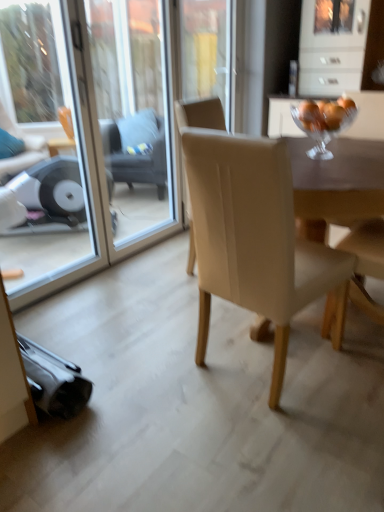
This screenshot has width=384, height=512. What do you see at coordinates (46, 151) in the screenshot?
I see `transparent glass screen door at left, which is counted as the 1th screen door, starting from the left` at bounding box center [46, 151].

Find the location of a particular element. dark gray fabric swivel chair at center is located at coordinates (138, 151).

Locate an element on the screen. This screenshot has height=512, width=384. beige fabric chair at center is located at coordinates (255, 238).

Image resolution: width=384 pixels, height=512 pixels. I want to click on clear glass bowl at upper right, so click(x=324, y=122).

Between clear glass bowl at upper right and dark gray fabric swivel chair at center, which one appears on the right side from the viewer's perspective?

clear glass bowl at upper right is more to the right.

Are clear glass bowl at upper right and dark gray fabric swivel chair at center far apart?

clear glass bowl at upper right is far away from dark gray fabric swivel chair at center.

Which object is thinner, transparent glass screen door at upper center, which appears as the 2th screen door when viewed from the left, or beige fabric chair at center?

Thinner between the two is transparent glass screen door at upper center, which appears as the 2th screen door when viewed from the left.

Considering the relative positions of transparent glass screen door at upper center, the 1th screen door when ordered from right to left, and beige fabric chair at center in the image provided, is transparent glass screen door at upper center, the 1th screen door when ordered from right to left, to the right of beige fabric chair at center from the viewer's perspective?

No.

From a real-world perspective, who is located lower, transparent glass screen door at upper center, which appears as the 2th screen door when viewed from the left, or beige fabric chair at center?

In real-world perspective, beige fabric chair at center is lower.

From the picture: Is clear glass bowl at upper right thinner than transparent glass screen door at left, marked as the second screen door in a right-to-left arrangement?

No.

From the image's perspective, who appears lower, clear glass bowl at upper right or transparent glass screen door at left, marked as the second screen door in a right-to-left arrangement?

transparent glass screen door at left, marked as the second screen door in a right-to-left arrangement, from the image's perspective.

Is clear glass bowl at upper right with transparent glass screen door at left, which is counted as the 1th screen door, starting from the left?

No, clear glass bowl at upper right is not in contact with transparent glass screen door at left, which is counted as the 1th screen door, starting from the left.

Is clear glass bowl at upper right oriented towards transparent glass screen door at left, marked as the second screen door in a right-to-left arrangement?

No, clear glass bowl at upper right is not turned towards transparent glass screen door at left, marked as the second screen door in a right-to-left arrangement.

Based on the photo, from the image's perspective, which object appears higher, clear glass bowl at upper right or transparent glass screen door at upper center, the 1th screen door when ordered from right to left?

transparent glass screen door at upper center, the 1th screen door when ordered from right to left.

Measure the distance from clear glass bowl at upper right to transparent glass screen door at upper center, the 1th screen door when ordered from right to left.

They are 5.69 feet apart.

In terms of height, does clear glass bowl at upper right look taller or shorter compared to transparent glass screen door at upper center, the 1th screen door when ordered from right to left?

In the image, clear glass bowl at upper right appears to be shorter than transparent glass screen door at upper center, the 1th screen door when ordered from right to left.

Based on the photo, does clear glass bowl at upper right have a greater width compared to transparent glass screen door at upper center, the 1th screen door when ordered from right to left?

Indeed, clear glass bowl at upper right has a greater width compared to transparent glass screen door at upper center, the 1th screen door when ordered from right to left.

Considering the sizes of clear glass bowl at upper right and beige fabric chair at center in the image, is clear glass bowl at upper right taller or shorter than beige fabric chair at center?

In the image, clear glass bowl at upper right appears to be shorter than beige fabric chair at center.

Is clear glass bowl at upper right touching beige fabric chair at center?

clear glass bowl at upper right is not next to beige fabric chair at center, and they're not touching.

Is clear glass bowl at upper right positioned with its back to beige fabric chair at center?

That's not correct — clear glass bowl at upper right is not looking away from beige fabric chair at center.

Does point (319, 130) come farther from viewer compared to point (235, 138)?

Yes, it is.

Does dark gray fabric swivel chair at center appear on the right side of transparent glass screen door at left, which is counted as the 1th screen door, starting from the left?

Yes.

Is the position of dark gray fabric swivel chair at center more distant than that of transparent glass screen door at left, which is counted as the 1th screen door, starting from the left?

Yes, dark gray fabric swivel chair at center is further from the camera.

From a real-world perspective, does dark gray fabric swivel chair at center sit lower than transparent glass screen door at left, marked as the second screen door in a right-to-left arrangement?

Yes.

Considering the positions of objects matte beige armchair at right and beige fabric chair at center in the image provided, who is in front, matte beige armchair at right or beige fabric chair at center?

→ beige fabric chair at center is more forward.

Which of these two, matte beige armchair at right or beige fabric chair at center, stands taller?

With more height is beige fabric chair at center.

Can you confirm if matte beige armchair at right is thinner than beige fabric chair at center?

Yes, matte beige armchair at right is thinner than beige fabric chair at center.

Is matte beige armchair at right bigger or smaller than beige fabric chair at center?

Clearly, matte beige armchair at right is smaller in size than beige fabric chair at center.

At what (x,y) coordinates should I click in order to perform the action: click on swivel chair below the clear glass bowl at upper right (from a real-world perspective). Please return your answer as a coordinate pair (x, y). The image size is (384, 512). Looking at the image, I should click on (138, 151).

Image resolution: width=384 pixels, height=512 pixels. I want to click on the 2nd screen door above the beige fabric chair at center (from a real-world perspective), so click(102, 126).

Estimate the real-world distances between objects in this image. Which object is closer to transparent glass screen door at left, marked as the second screen door in a right-to-left arrangement, beige fabric chair at center or transparent glass screen door at upper center, the 1th screen door when ordered from right to left?

Based on the image, transparent glass screen door at upper center, the 1th screen door when ordered from right to left, appears to be nearer to transparent glass screen door at left, marked as the second screen door in a right-to-left arrangement.

Which object lies further to the anchor point clear glass bowl at upper right, transparent glass screen door at left, marked as the second screen door in a right-to-left arrangement, or transparent glass screen door at upper center, which appears as the 2th screen door when viewed from the left?

The object further to clear glass bowl at upper right is transparent glass screen door at left, marked as the second screen door in a right-to-left arrangement.

Which object lies further to the anchor point clear glass bowl at upper right, matte beige armchair at right or transparent glass screen door at left, which is counted as the 1th screen door, starting from the left?

transparent glass screen door at left, which is counted as the 1th screen door, starting from the left, is positioned further to the anchor clear glass bowl at upper right.

Estimate the real-world distances between objects in this image. Which object is closer to transparent glass screen door at left, marked as the second screen door in a right-to-left arrangement, clear glass bowl at upper right or beige fabric chair at center?

beige fabric chair at center.

In the scene shown: Based on their spatial positions, is clear glass bowl at upper right or transparent glass screen door at left, which is counted as the 1th screen door, starting from the left, closer to transparent glass screen door at upper center, which appears as the 2th screen door when viewed from the left?

transparent glass screen door at left, which is counted as the 1th screen door, starting from the left, is closer to transparent glass screen door at upper center, which appears as the 2th screen door when viewed from the left.

Looking at this image, considering their positions, is transparent glass screen door at upper center, the 1th screen door when ordered from right to left, positioned closer to dark gray fabric swivel chair at center than transparent glass screen door at left, which is counted as the 1th screen door, starting from the left?

transparent glass screen door at upper center, the 1th screen door when ordered from right to left, lies closer to dark gray fabric swivel chair at center than the other object.

From the image, which object appears to be nearer to dark gray fabric swivel chair at center, transparent glass screen door at upper center, the 1th screen door when ordered from right to left, or clear glass bowl at upper right?

transparent glass screen door at upper center, the 1th screen door when ordered from right to left.

Consider the image. Which object lies nearer to the anchor point beige fabric chair at center, clear glass bowl at upper right or transparent glass screen door at upper center, which appears as the 2th screen door when viewed from the left?

Based on the image, clear glass bowl at upper right appears to be nearer to beige fabric chair at center.

Where is `wine glass between matte beige armchair at right and dark gray fabric swivel chair at center along the z-axis`? wine glass between matte beige armchair at right and dark gray fabric swivel chair at center along the z-axis is located at coordinates (324, 122).

Locate an element on the screen. wine glass between transparent glass screen door at upper center, which appears as the 2th screen door when viewed from the left, and matte beige armchair at right from left to right is located at coordinates point(324,122).

Locate an element on the screen. The height and width of the screenshot is (512, 384). screen door between transparent glass screen door at upper center, which appears as the 2th screen door when viewed from the left, and dark gray fabric swivel chair at center in the front-back direction is located at coordinates (46, 151).

You are a GUI agent. You are given a task and a screenshot of the screen. Output one action in this format:
    pyautogui.click(x=<x>, y=<y>)
    Task: Click on the wine glass between transparent glass screen door at left, which is counted as the 1th screen door, starting from the left, and dark gray fabric swivel chair at center, along the z-axis
    The height and width of the screenshot is (512, 384).
    Given the screenshot: What is the action you would take?
    pyautogui.click(x=324, y=122)